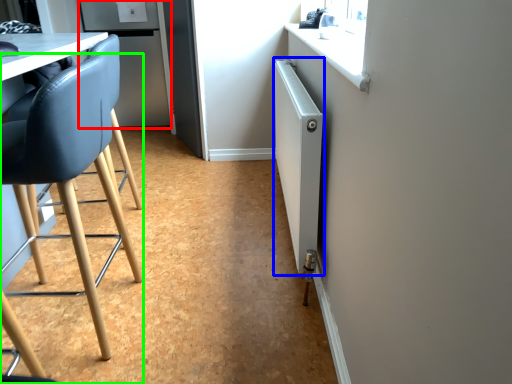
Question: Based on their relative distances, which object is nearer to fridge (highlighted by a red box)? Choose from radiator (highlighted by a blue box) and chair (highlighted by a green box).

Choices:
 (A) radiator
 (B) chair

Answer: (A)